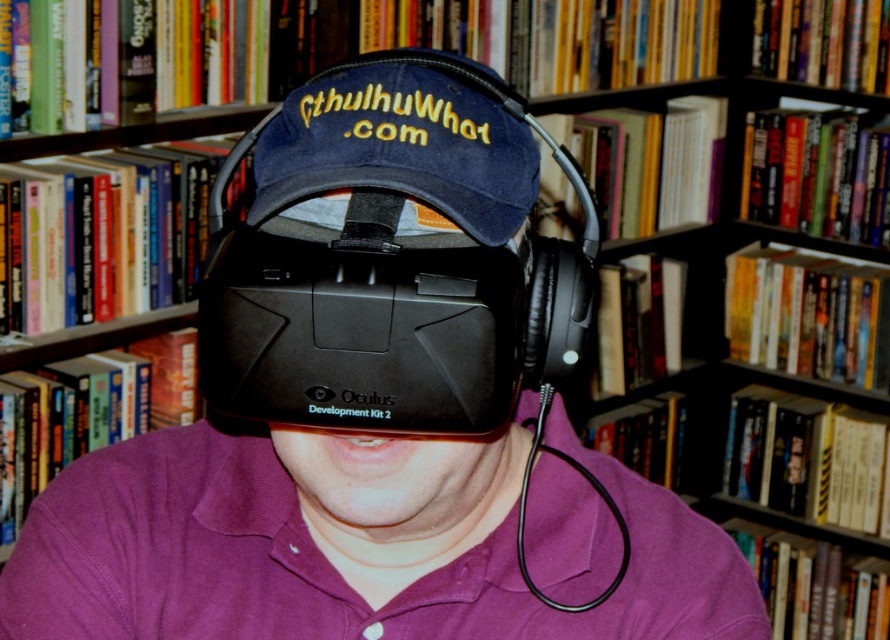
What are the exact coordinates of the black matte VR headset at center in the image?

The black matte VR headset at center is located at point coordinates of (392, 260).

You are a photographer trying to capture a closeup of the black matte vr headset at center and denim baseball cap at center. Since you want to focus on the headset, which object should you move closer to the camera?

The black matte vr headset at center is bigger than denim baseball cap at center, so you should move the black matte vr headset at center closer to the camera to ensure it is the focus.

You are a photographer trying to capture a photo of the person in the scene. You notice two points in the image at coordinates point (x=340, y=308) and point (x=257, y=166). Which point should you focus on to ensure the person is in sharp focus?

You should focus on point (x=340, y=308) because it is closer to the viewer than point (x=257, y=166), ensuring the person wearing the Oculus Development Kit 2 and dark blue baseball cap is in sharp focus.